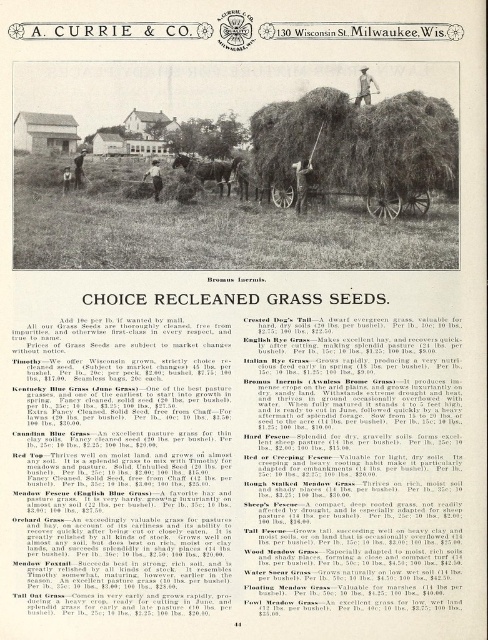
Is green grass at center above brown leather coach at center?

No.

Consider the image. Can you confirm if green grass at center is positioned below brown leather coach at center?

Yes.

Which is behind, point (322, 228) or point (372, 81)?

The point (372, 81) is more distant.

Find the location of a particular element. green grass at center is located at coordinates (206, 227).

Who is positioned more to the right, green grass at center or wooden cart at center?

Positioned to the right is wooden cart at center.

Is point (443, 228) positioned before point (427, 209)?

Yes, point (443, 228) is closer to viewer.

What do you see at coordinates (206, 227) in the screenshot? I see `green grass at center` at bounding box center [206, 227].

At what (x,y) coordinates should I click in order to perform the action: click on green grass at center. Please return your answer as a coordinate pair (x, y). Looking at the image, I should click on (206, 227).

Does green grass at center have a lesser width compared to brown wooden wagon at center?

No, green grass at center is not thinner than brown wooden wagon at center.

Locate an element on the screen. The height and width of the screenshot is (640, 488). green grass at center is located at coordinates (206, 227).